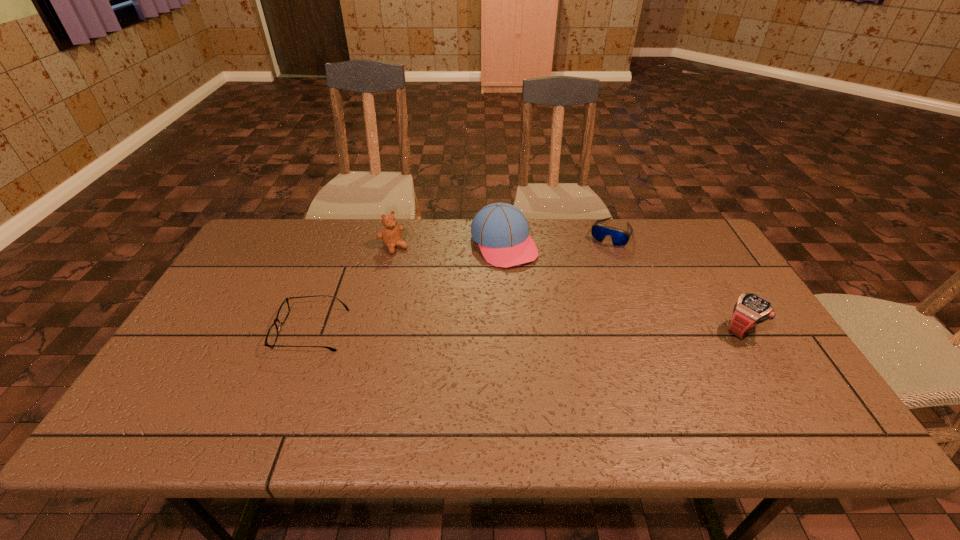
What are the coordinates of `free space between the spectacles and the watch` in the screenshot? It's located at (526, 329).

What are the coordinates of `free point between the sunglasses and the rightmost object` in the screenshot? It's located at (676, 281).

You are a GUI agent. You are given a task and a screenshot of the screen. Output one action in this format:
    pyautogui.click(x=<x>, y=<y>)
    Task: Click on the free spot between the spectacles and the watch
    This screenshot has width=960, height=540.
    Given the screenshot: What is the action you would take?
    pyautogui.click(x=526, y=329)

Identify the location of free space between the baseball cap and the watch. (623, 287).

What are the coordinates of `free space between the fourth tallest object and the watch` in the screenshot? It's located at (676, 281).

Locate an element on the screen. This screenshot has height=540, width=960. free space between the rightmost object and the teddy bear is located at coordinates (567, 288).

Where is `empty space that is in between the sunglasses and the leftmost object`? The image size is (960, 540). empty space that is in between the sunglasses and the leftmost object is located at coordinates (461, 281).

Identify which object is the fourth nearest to the shortest object. Please provide its 2D coordinates. Your answer should be formatted as a tuple, i.e. [(x, y)], where the tuple contains the x and y coordinates of a point satisfying the conditions above.

[(750, 309)]

Identify the location of the third closest object relative to the third object from right to left. The width and height of the screenshot is (960, 540). (283, 312).

Where is `vacant space that satisfies the following two spatial constraints: 1. on the front side of the third shortest object; 2. on the right side of the teddy bear`? Image resolution: width=960 pixels, height=540 pixels. vacant space that satisfies the following two spatial constraints: 1. on the front side of the third shortest object; 2. on the right side of the teddy bear is located at coordinates [373, 329].